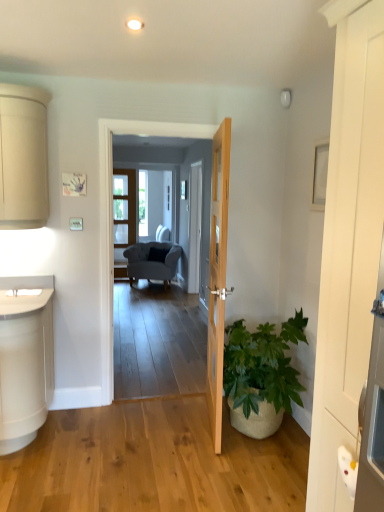
Question: Does natural wood door at center, positioned as the second door in right-to-left order, come in front of suede gray armchair at center?

Choices:
 (A) no
 (B) yes

Answer: (B)

Question: Is natural wood door at center, which is the second door from front to back, shorter than suede gray armchair at center?

Choices:
 (A) no
 (B) yes

Answer: (A)

Question: Is suede gray armchair at center completely or partially inside natural wood door at center, which is the second door from front to back?

Choices:
 (A) yes
 (B) no

Answer: (B)

Question: Is natural wood door at center, which ranks as the first door in back-to-front order, positioned far away from suede gray armchair at center?

Choices:
 (A) yes
 (B) no

Answer: (A)

Question: Are natural wood door at center, which is counted as the 1th door, starting from the left, and suede gray armchair at center making contact?

Choices:
 (A) no
 (B) yes

Answer: (A)

Question: Is natural wood door at center, which is counted as the 1th door, starting from the left, oriented away from suede gray armchair at center?

Choices:
 (A) yes
 (B) no

Answer: (B)

Question: Is smooth gray carpet at center facing towards green leafy plant in woven basket at lower right?

Choices:
 (A) yes
 (B) no

Answer: (B)

Question: Is smooth gray carpet at center turned away from green leafy plant in woven basket at lower right?

Choices:
 (A) yes
 (B) no

Answer: (B)

Question: Is smooth gray carpet at center smaller than green leafy plant in woven basket at lower right?

Choices:
 (A) no
 (B) yes

Answer: (B)

Question: Would you say green leafy plant in woven basket at lower right is part of smooth gray carpet at center's contents?

Choices:
 (A) yes
 (B) no

Answer: (B)

Question: From a real-world perspective, does smooth gray carpet at center sit lower than green leafy plant in woven basket at lower right?

Choices:
 (A) yes
 (B) no

Answer: (B)

Question: Is smooth gray carpet at center in contact with green leafy plant in woven basket at lower right?

Choices:
 (A) no
 (B) yes

Answer: (A)

Question: Can you confirm if green leafy plant in woven basket at lower right is wider than natural wood door at center, positioned as the second door in right-to-left order?

Choices:
 (A) yes
 (B) no

Answer: (A)